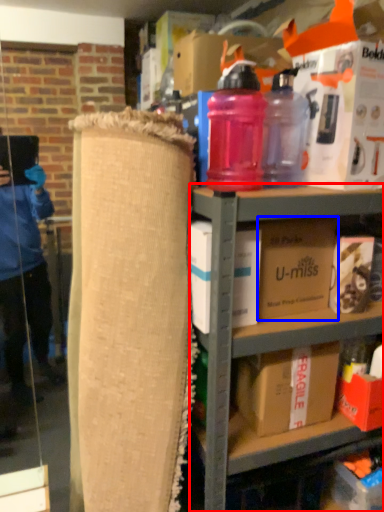
Question: Which of the following is the farthest to the observer, shelf (highlighted by a red box) or box (highlighted by a blue box)?

Choices:
 (A) shelf
 (B) box

Answer: (B)